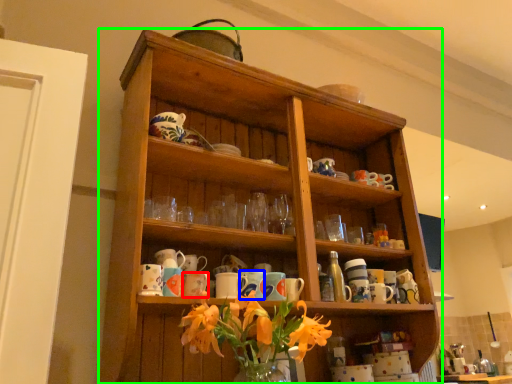
Question: Based on their relative distances, which object is nearer to mug (highlighted by a red box)? Choose from mug (highlighted by a blue box) and shelf (highlighted by a green box).

Choices:
 (A) mug
 (B) shelf

Answer: (A)